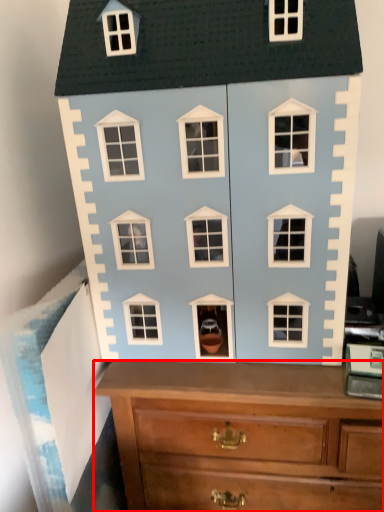
Question: From the image's perspective, what is the correct spatial relationship of chest of drawers (annotated by the red box) in relation to toy?

Choices:
 (A) above
 (B) below

Answer: (B)